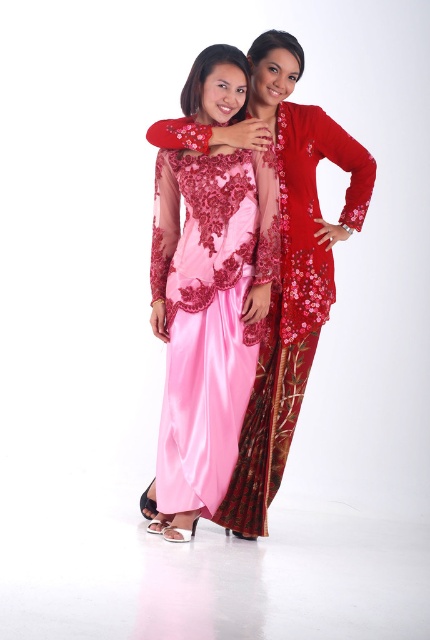
Question: Is satin pink dress at center positioned at the back of velvet red robe at center?

Choices:
 (A) no
 (B) yes

Answer: (A)

Question: Is satin pink dress at center further to the viewer compared to velvet red robe at center?

Choices:
 (A) no
 (B) yes

Answer: (A)

Question: Observing the image, what is the correct spatial positioning of satin pink dress at center in reference to velvet red robe at center?

Choices:
 (A) left
 (B) right

Answer: (A)